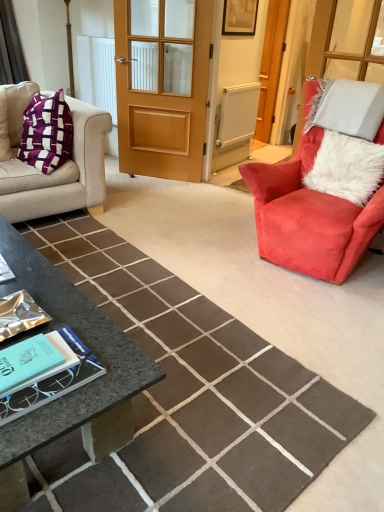
Locate an element on the screen. Image resolution: width=384 pixels, height=512 pixels. vacant area to the right of teal matte book at lower left is located at coordinates (107, 376).